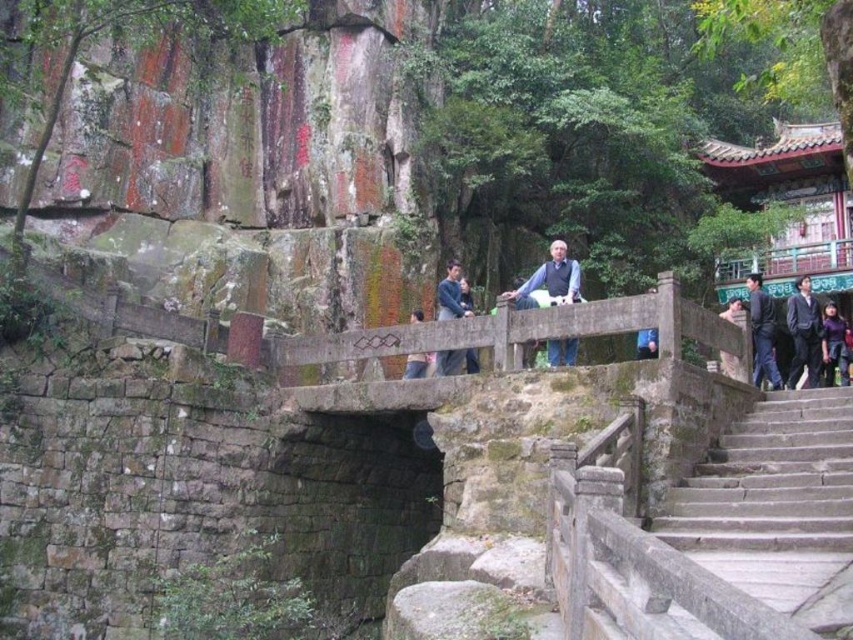
Question: Can you confirm if purple fabric at lower right is positioned below blue fabric bag at center?

Choices:
 (A) no
 (B) yes

Answer: (B)

Question: Among these points, which one is farthest from the camera?

Choices:
 (A) (549, 348)
 (B) (749, 316)

Answer: (B)

Question: Does black fabric jacket at right have a greater width compared to dark blue jeans at center?

Choices:
 (A) no
 (B) yes

Answer: (B)

Question: Estimate the real-world distances between objects in this image. Which object is closer to the stone bridge at center?

Choices:
 (A) light blue denim jacket at center
 (B) black fabric jacket at right
 (C) dark blue sweater at center
 (D) purple fabric at lower right

Answer: (C)

Question: Which object is closer to the camera taking this photo?

Choices:
 (A) blue fabric bag at center
 (B) stone stairs at center

Answer: (B)

Question: Is light blue denim jacket at center bigger than light brown leather jacket at upper right?

Choices:
 (A) no
 (B) yes

Answer: (A)